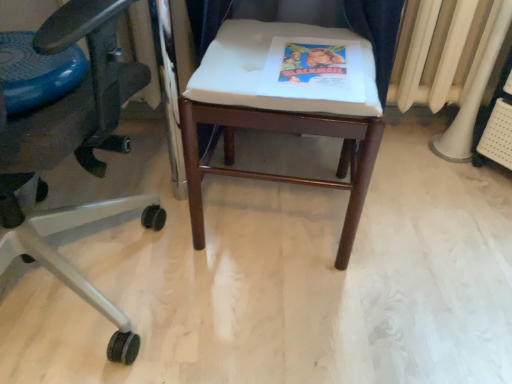
The height and width of the screenshot is (384, 512). I want to click on vacant space in front of white fabric stool at center, so click(302, 317).